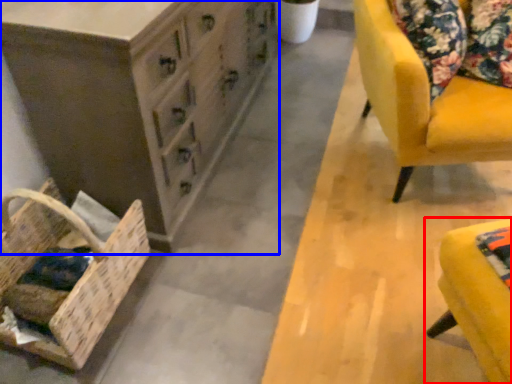
Question: Which point is further to the camera, furniture (highlighted by a red box) or chest of drawers (highlighted by a blue box)?

Choices:
 (A) furniture
 (B) chest of drawers

Answer: (B)